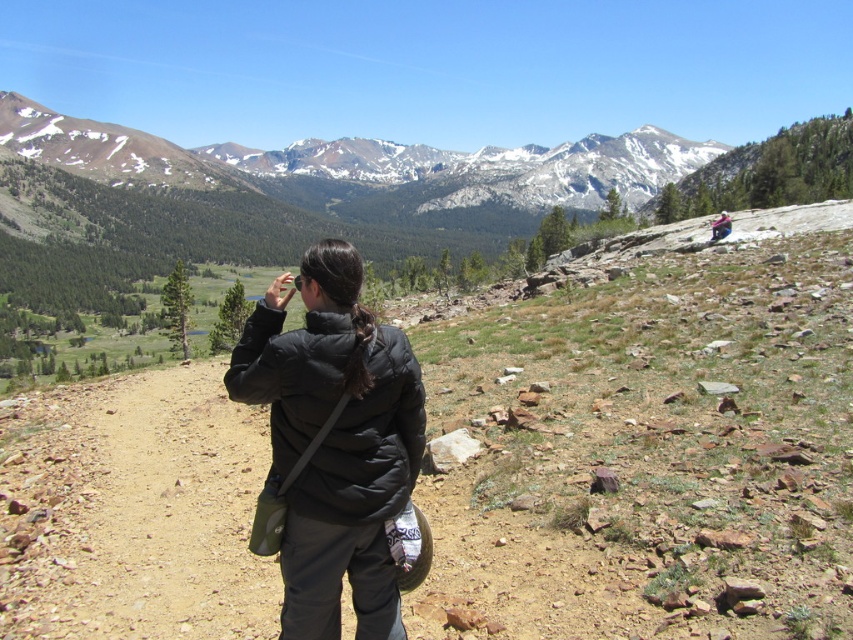
You are standing on the dirt path in the foreground of this mountain scene. You notice two points marked in the image. Which point, point [224,381] or point [722,227], is closer to you?

Point [224,381] is closer to the viewer than point [722,227].

You are a hiker trying to decide which jacket to wear for the day. You see the black puffer jacket at center and the matte black jacket at upper right in the image. Which jacket appears taller in the picture?

The black puffer jacket at center is much taller than the matte black jacket at upper right, so the black puffer jacket at center appears taller in the picture.